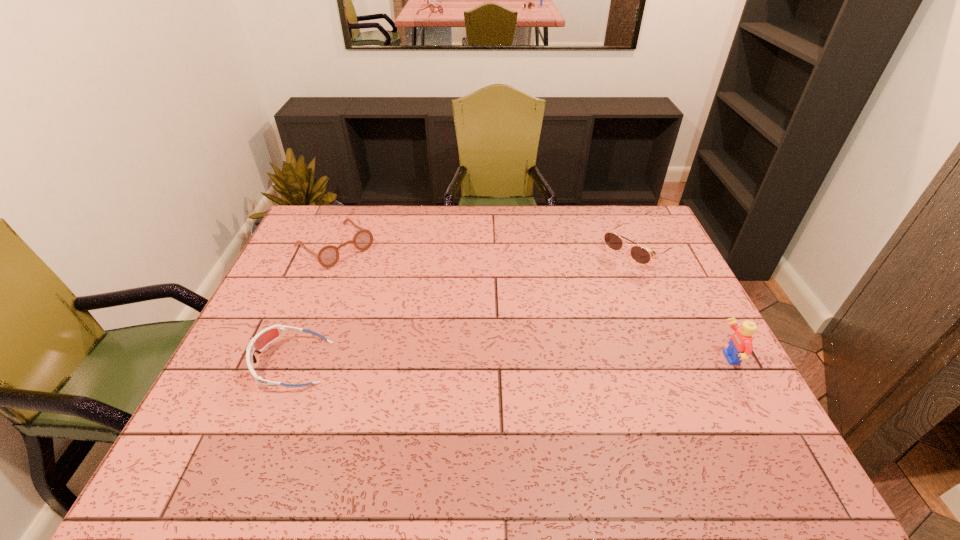
Where is `free spot that satisfies the following two spatial constraints: 1. on the front side of the Lego; 2. on the face of the spectacles`? The image size is (960, 540). free spot that satisfies the following two spatial constraints: 1. on the front side of the Lego; 2. on the face of the spectacles is located at coordinates (288, 359).

Locate an element on the screen. The height and width of the screenshot is (540, 960). vacant position in the image that satisfies the following two spatial constraints: 1. on the front side of the spectacles; 2. on the face of the Lego is located at coordinates (288, 359).

Identify the location of vacant region that satisfies the following two spatial constraints: 1. on the front side of the second tallest object; 2. on the left side of the spectacles. Image resolution: width=960 pixels, height=540 pixels. (332, 252).